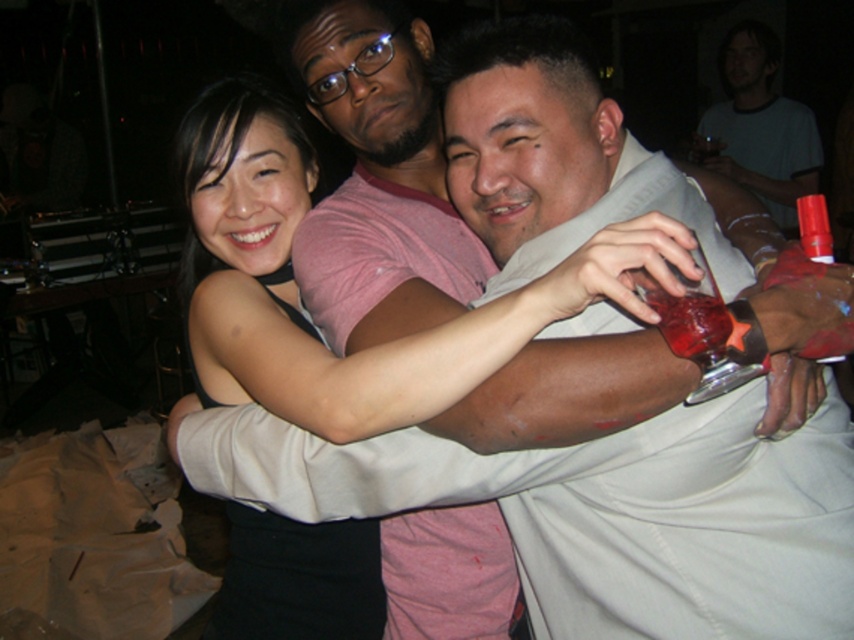
You are at a party and need to pour a drink into the translucent glass at right. You have a bottle of water in your hand. Is the matte white shirt at upper right in the way of pouring the water into the glass?

The matte white shirt at upper right has a larger size compared to the translucent glass at right, so it might block the path to the glass. You should move the shirt or adjust your position to avoid it.

You are at a party and want to move from the point at coordinates point (755, 193) to the point at coordinates point (711, 321). Which direction should you move in?

You should move forward because point (755, 193) is behind point (711, 321), so moving forward from point (755, 193) will bring you closer to point (711, 321).